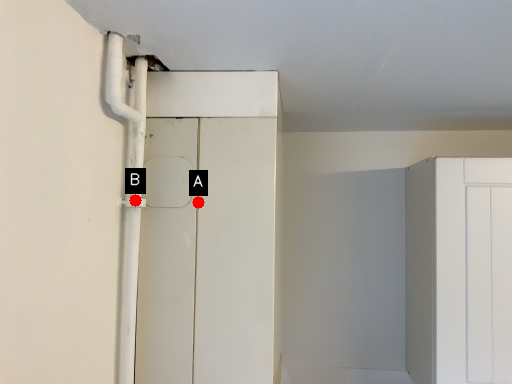
Question: Two points are circled on the image, labeled by A and B beside each circle. Which point is further to the camera?

Choices:
 (A) A is further
 (B) B is further

Answer: (A)